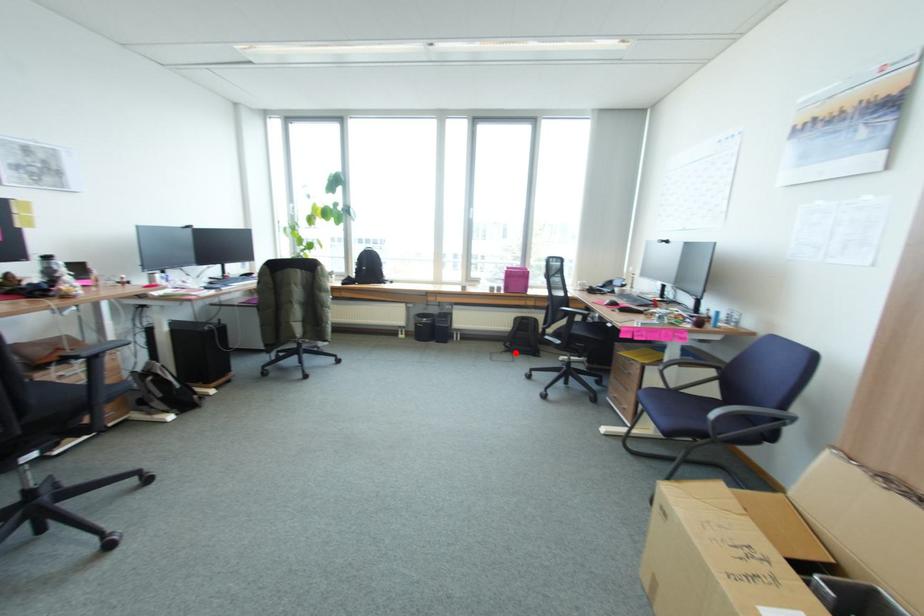
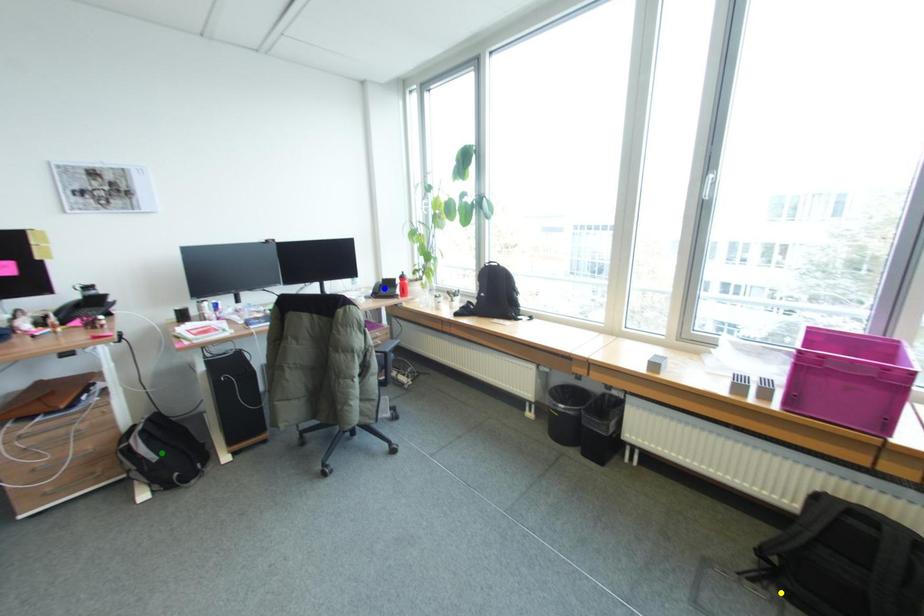
Question: I am providing you with two images of the same scene from different viewpoints. A red point is marked on the first image. You are given multiple points on the second image. Which spot in image 2 lines up with the point in image 1?

Choices:
 (A) yellow point
 (B) green point
 (C) blue point

Answer: (A)